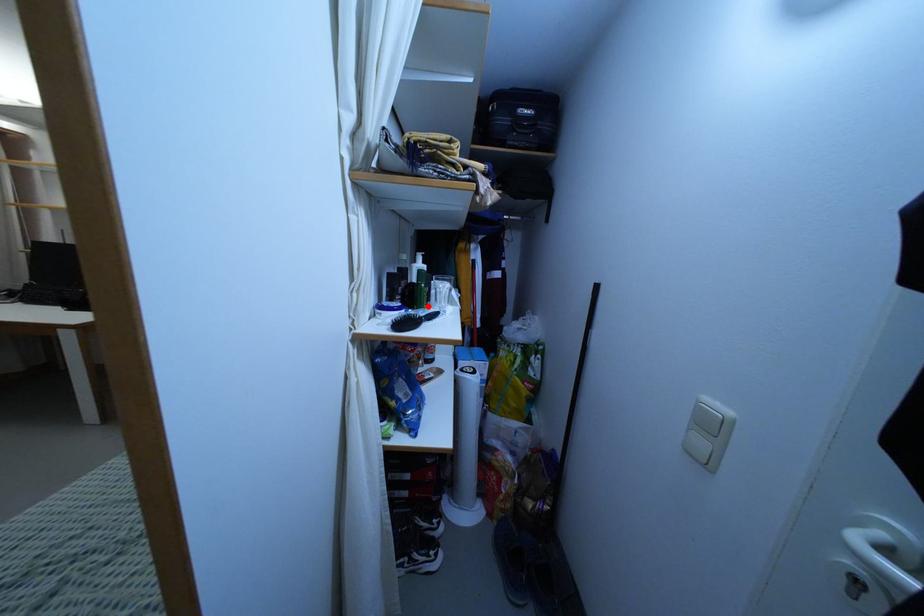
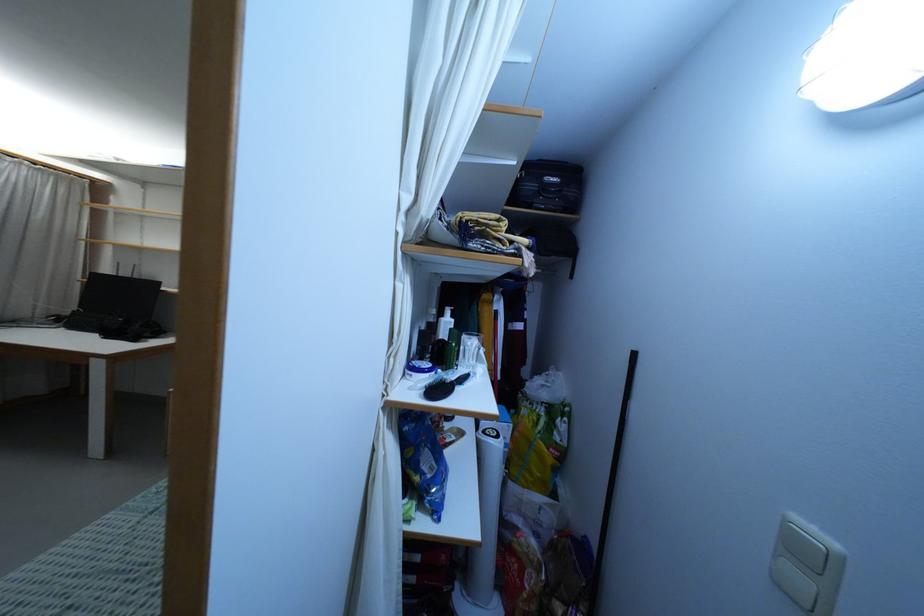
In the second image, find the point that corresponds to the highlighted location in the first image.

(456, 365)